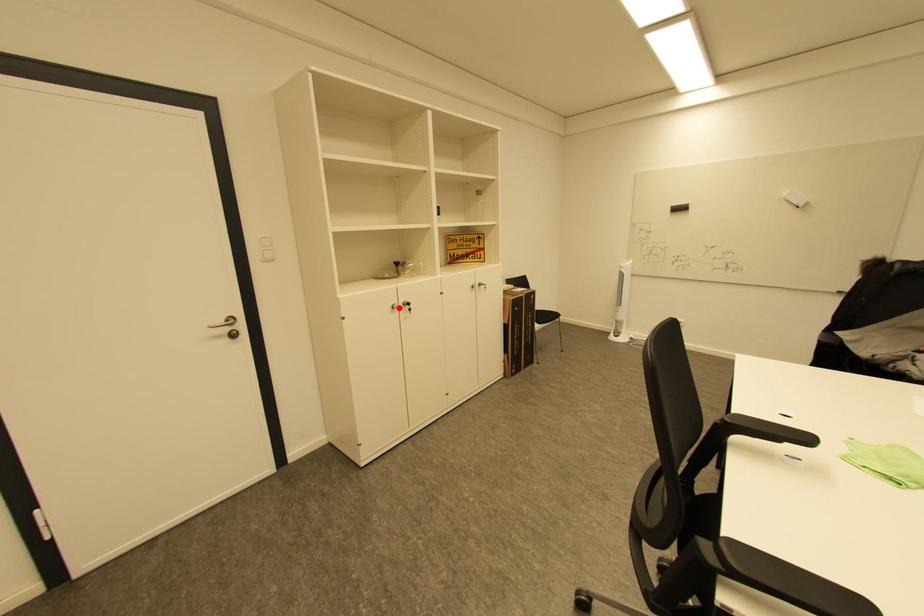
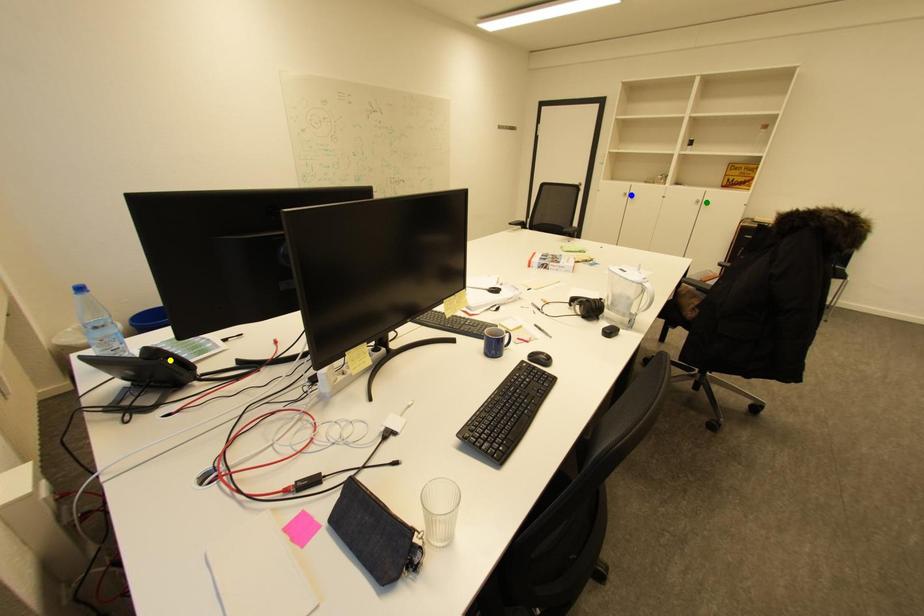
Question: I am providing you with two images of the same scene from different viewpoints. A red point is marked on the first image. You are given multiple points on the second image. Which mark in image 2 goes with the point in image 1?

Choices:
 (A) green point
 (B) yellow point
 (C) blue point

Answer: (C)